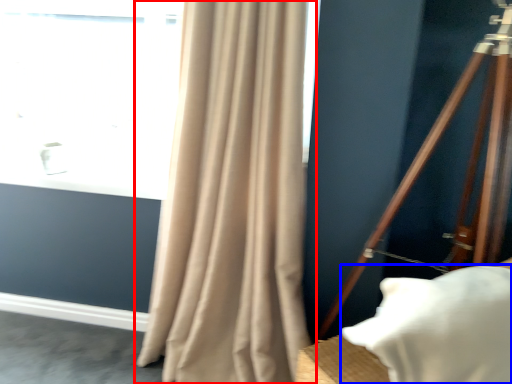
Question: Which object appears closest to the camera in this image, curtain (highlighted by a red box) or pillow (highlighted by a blue box)?

Choices:
 (A) curtain
 (B) pillow

Answer: (B)